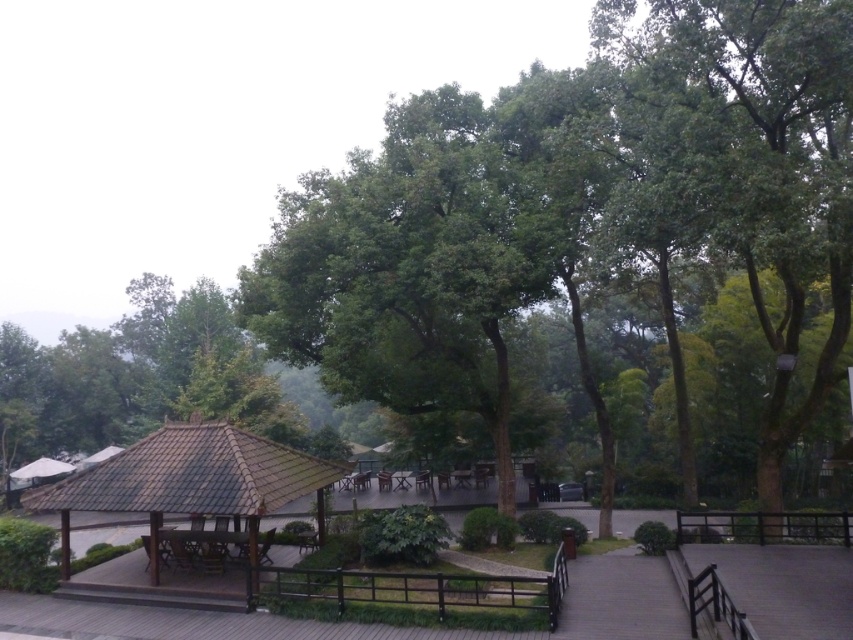
Question: Which point is closer to the camera?

Choices:
 (A) white fabric canopy at upper left
 (B) wooden picnic table at center

Answer: (B)

Question: Can you confirm if brown wooden gazebo at center is bigger than wooden picnic table at center?

Choices:
 (A) no
 (B) yes

Answer: (B)

Question: Observing the image, what is the correct spatial positioning of brown wooden gazebo at center in reference to white fabric canopy at upper left?

Choices:
 (A) below
 (B) above

Answer: (B)

Question: Considering the real-world distances, which object is farthest from the white fabric canopy at upper left?

Choices:
 (A) wooden picnic table at center
 (B) brown wooden gazebo at center

Answer: (B)

Question: In this image, where is brown wooden gazebo at center located relative to wooden picnic table at center?

Choices:
 (A) above
 (B) below

Answer: (A)

Question: Which of the following is the closest to the observer?

Choices:
 (A) (48, 467)
 (B) (241, 557)
 (C) (250, 545)

Answer: (C)